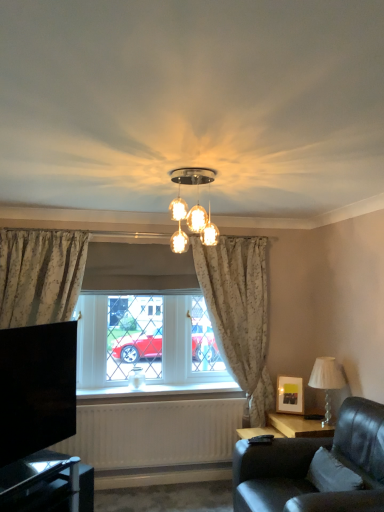
Question: Does white textured lampshade at right, arranged as the first lamp when ordered from the bottom, have a lesser width compared to white textured radiator at lower center?

Choices:
 (A) no
 (B) yes

Answer: (A)

Question: Is white textured lampshade at right, the second lamp viewed from the front, located outside white textured radiator at lower center?

Choices:
 (A) no
 (B) yes

Answer: (B)

Question: Is white textured lampshade at right, which is the first lamp in back-to-front order, at the right side of white textured radiator at lower center?

Choices:
 (A) yes
 (B) no

Answer: (A)

Question: Considering the relative sizes of white textured lampshade at right, positioned as the 1th lamp in right-to-left order, and white textured radiator at lower center in the image provided, is white textured lampshade at right, positioned as the 1th lamp in right-to-left order, bigger than white textured radiator at lower center?

Choices:
 (A) yes
 (B) no

Answer: (B)

Question: Is white textured lampshade at right, the second lamp when ordered from top to bottom, directly adjacent to white textured radiator at lower center?

Choices:
 (A) yes
 (B) no

Answer: (B)

Question: Is white textured radiator at lower center completely or partially inside white textured lampshade at right, positioned as the 1th lamp in right-to-left order?

Choices:
 (A) no
 (B) yes

Answer: (A)

Question: Is white textured lampshade at right, arranged as the first lamp when ordered from the bottom, far from leather couch at lower right?

Choices:
 (A) yes
 (B) no

Answer: (B)

Question: Is white textured lampshade at right, the second lamp when ordered from top to bottom, located outside leather couch at lower right?

Choices:
 (A) no
 (B) yes

Answer: (B)

Question: From the image's perspective, is white textured lampshade at right, arranged as the first lamp when ordered from the bottom, located above leather couch at lower right?

Choices:
 (A) yes
 (B) no

Answer: (A)

Question: Is white textured lampshade at right, which is the 2th lamp in left-to-right order, bigger than leather couch at lower right?

Choices:
 (A) no
 (B) yes

Answer: (A)

Question: From a real-world perspective, is white textured lampshade at right, arranged as the first lamp when ordered from the bottom, on top of leather couch at lower right?

Choices:
 (A) no
 (B) yes

Answer: (B)

Question: Is leather couch at lower right surrounded by white textured lampshade at right, which is the first lamp in back-to-front order?

Choices:
 (A) no
 (B) yes

Answer: (A)

Question: Does translucent glass chandelier at center, the 2th lamp from the back, appear on the left side of black glossy tv at lower left?

Choices:
 (A) yes
 (B) no

Answer: (B)